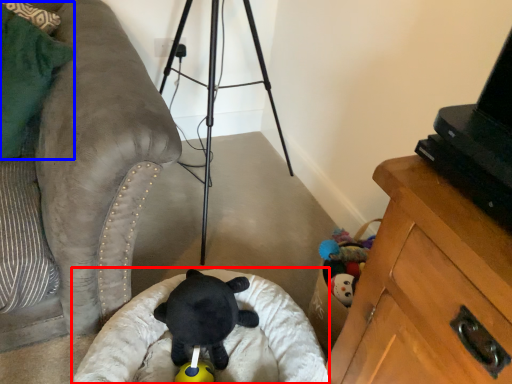
Question: Which object is closer to the camera taking this photo, infant bed (highlighted by a red box) or pillow (highlighted by a blue box)?

Choices:
 (A) infant bed
 (B) pillow

Answer: (B)